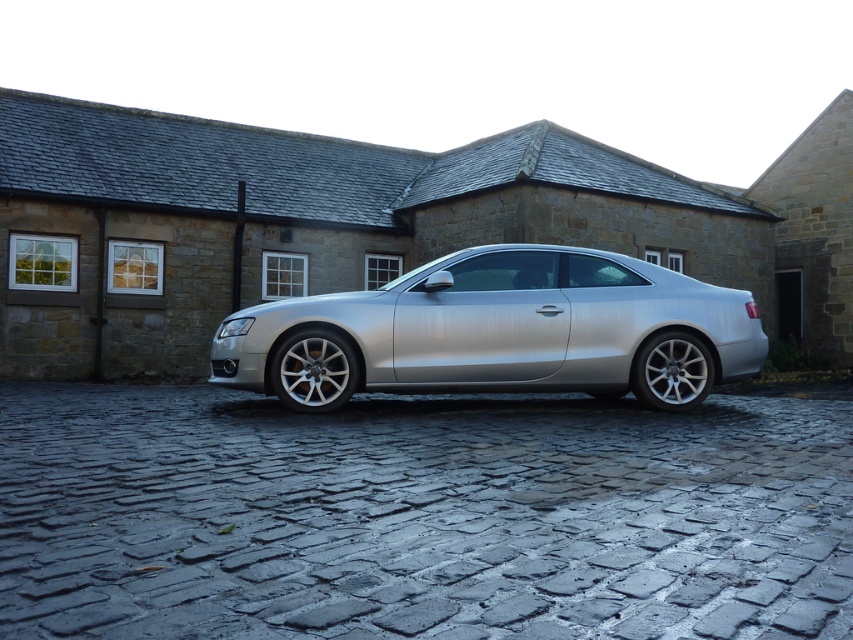
You are a delivery person trying to park a new car that is the same size as the silver metallic car at center. The parking spot is the dark gray cobblestone driveway at center. Based on the scene, will your new car fit in the parking spot?

The dark gray cobblestone driveway at center occupies less space than the silver metallic car at center, so the new car will not fit in the parking spot.

You are standing at the entrance of the stone building and want to park your car on the dark gray cobblestone driveway at center. Based on the coordinates provided, is the driveway positioned to the left or right of the building?

The dark gray cobblestone driveway at center is located at coordinates point (421, 516), which places it to the right of the building.

You are a delivery person trying to park your van in the driveway. You see the dark gray cobblestone driveway at center and the silver metallic car at center. Which object is positioned to the left of the other?

The dark gray cobblestone driveway at center is to the left of the silver metallic car at center according to the description.